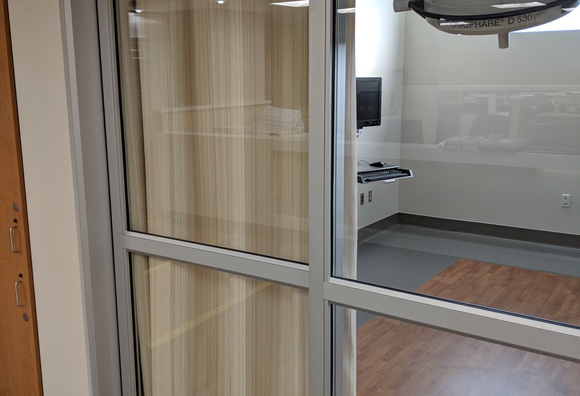
At what (x,y) coordinates should I click in order to perform the action: click on metal door handle. Please return your answer as a coordinate pair (x, y). The image size is (580, 396). Looking at the image, I should click on (16, 296), (9, 240).